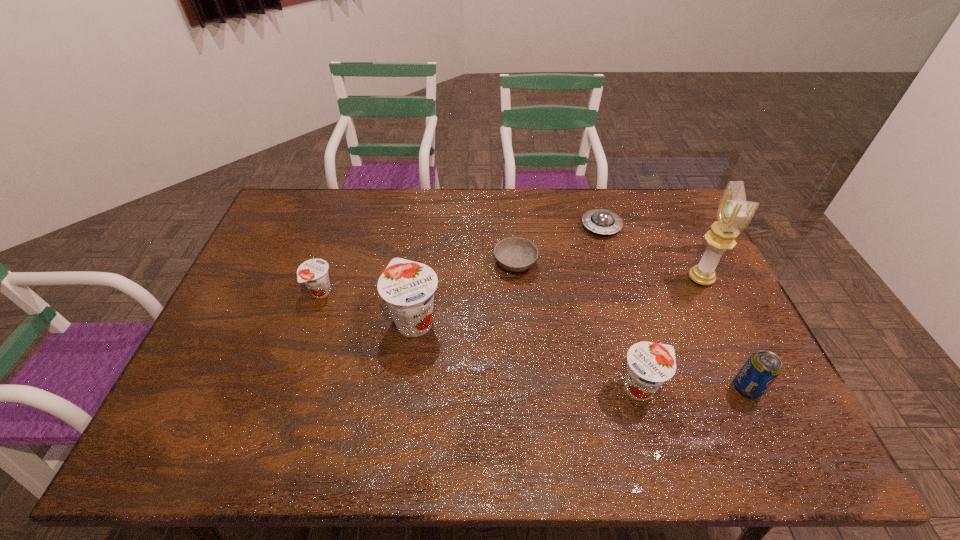
To ensure equal spacing by inserting another yogurt among them, please point out a vacant spot for this new yogurt. Please provide its 2D coordinates. Your answer should be formatted as a tuple, i.e. [(x, y)], where the tuple contains the x and y coordinates of a point satisfying the conditions above.

[(520, 352)]